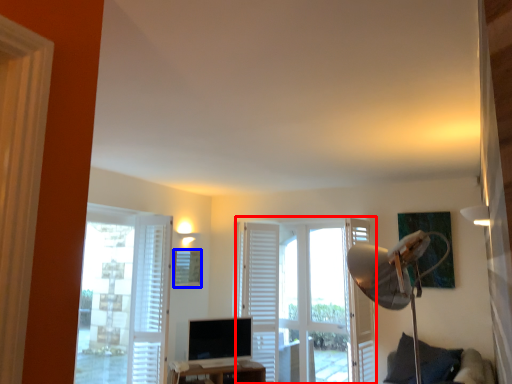
Question: Which object is further to the camera taking this photo, door (highlighted by a red box) or picture frame (highlighted by a blue box)?

Choices:
 (A) door
 (B) picture frame

Answer: (B)